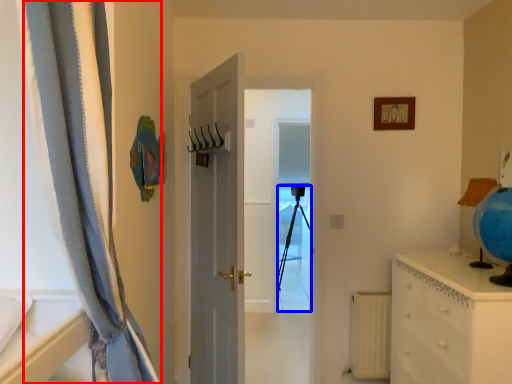
Question: Among these objects, which one is nearest to the camera, curtain (highlighted by a red box) or tripod (highlighted by a blue box)?

Choices:
 (A) curtain
 (B) tripod

Answer: (A)